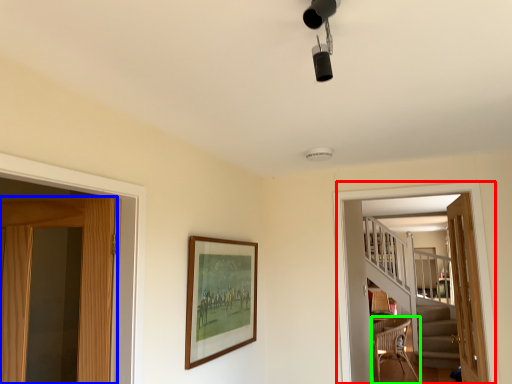
Question: Which object is positioned closest to screen door (highlighted by a red box)? Select from door (highlighted by a blue box) and chair (highlighted by a green box).

Choices:
 (A) door
 (B) chair

Answer: (A)